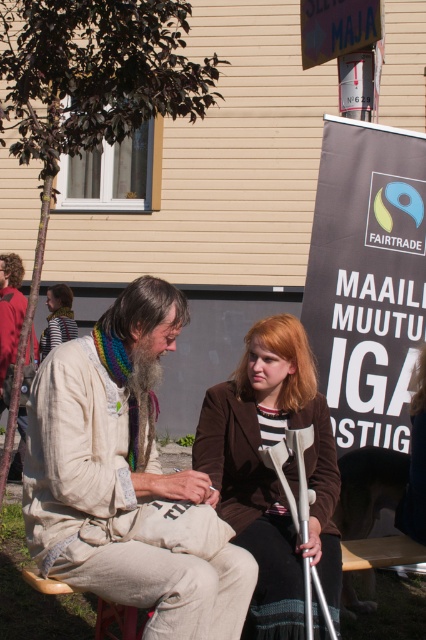
You are a physical therapist observing the scene. You notice the brown fabric crutches at center and the beige fabric jacket at lower left. Which object is located below the other?

The brown fabric crutches at center are positioned under the beige fabric jacket at lower left, meaning the crutches are below the jacket.

In the scene described, there are two people sitting on a bench. The older man on the left is wearing a light beige fabric jacket at center. The younger woman on the right is holding a point at (123, 476). Which person is wearing the light beige fabric jacket?

The older man on the left is wearing the light beige fabric jacket at center, as indicated by the point marked at (123, 476).

You are a tailor measuring items for alterations. You have a light beige fabric jacket at center and brown fabric crutches at center. Which item requires a wider alteration measurement?

The light beige fabric jacket at center requires a wider alteration measurement since it might be wider than the brown fabric crutches at center.